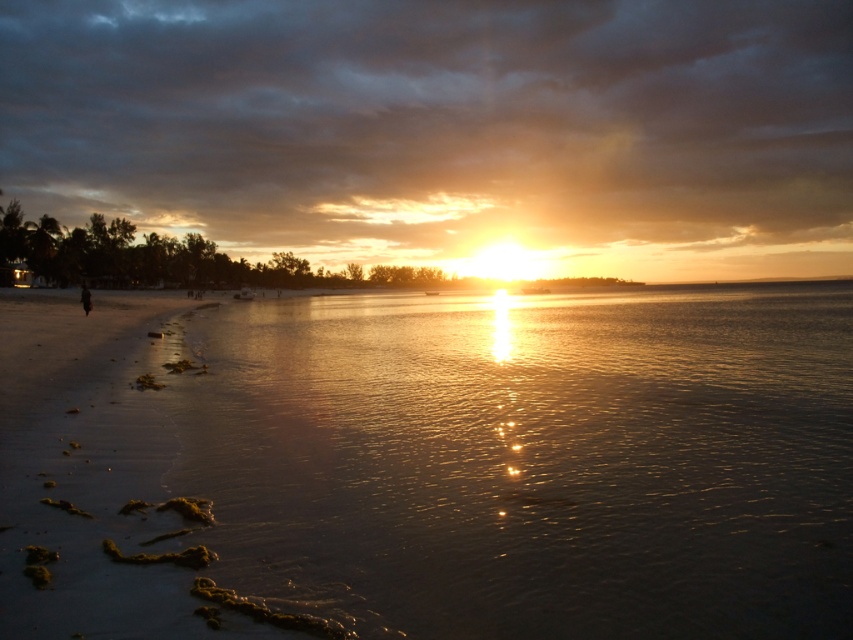
Which is behind, point (672, 490) or point (84, 288)?

Positioned behind is point (84, 288).

Can you confirm if glistening water at center is taller than dark hair at left?

Yes, glistening water at center is taller than dark hair at left.

What do you see at coordinates (532, 460) in the screenshot?
I see `glistening water at center` at bounding box center [532, 460].

Find the location of `glistening water at center`. glistening water at center is located at coordinates (532, 460).